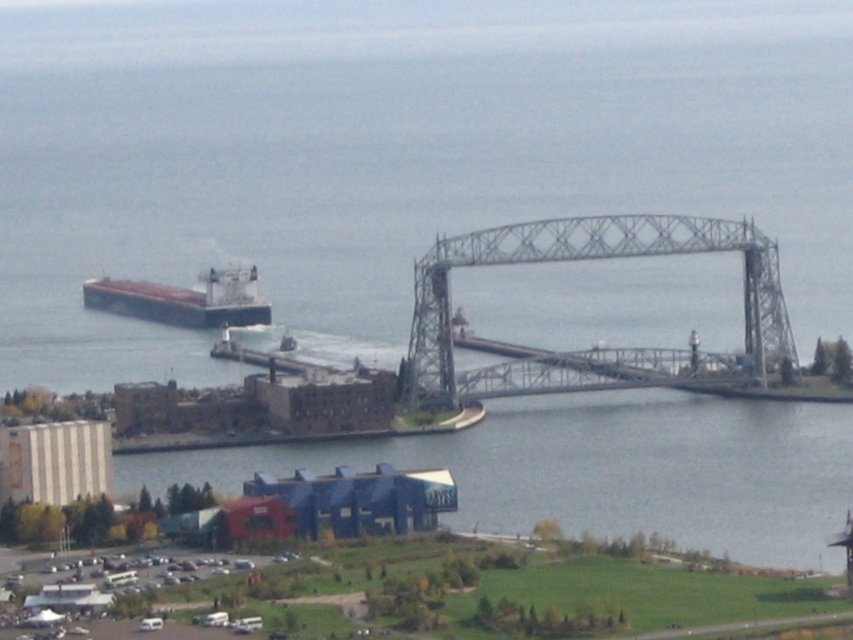
Question: Which of the following is the farthest from the observer?

Choices:
 (A) brown matte cargo ship at left
 (B) gray metallic bridge at center

Answer: (A)

Question: Which point is closer to the camera?

Choices:
 (A) brown matte cargo ship at left
 (B) gray metallic bridge at center

Answer: (B)

Question: Does gray metallic bridge at center appear on the right side of brown matte cargo ship at left?

Choices:
 (A) yes
 (B) no

Answer: (A)

Question: Is gray metallic bridge at center positioned before brown matte cargo ship at left?

Choices:
 (A) yes
 (B) no

Answer: (A)

Question: Which point is closer to the camera?

Choices:
 (A) gray metallic bridge at center
 (B) brown matte cargo ship at left

Answer: (A)

Question: Is gray metallic bridge at center to the right of brown matte cargo ship at left from the viewer's perspective?

Choices:
 (A) no
 (B) yes

Answer: (B)